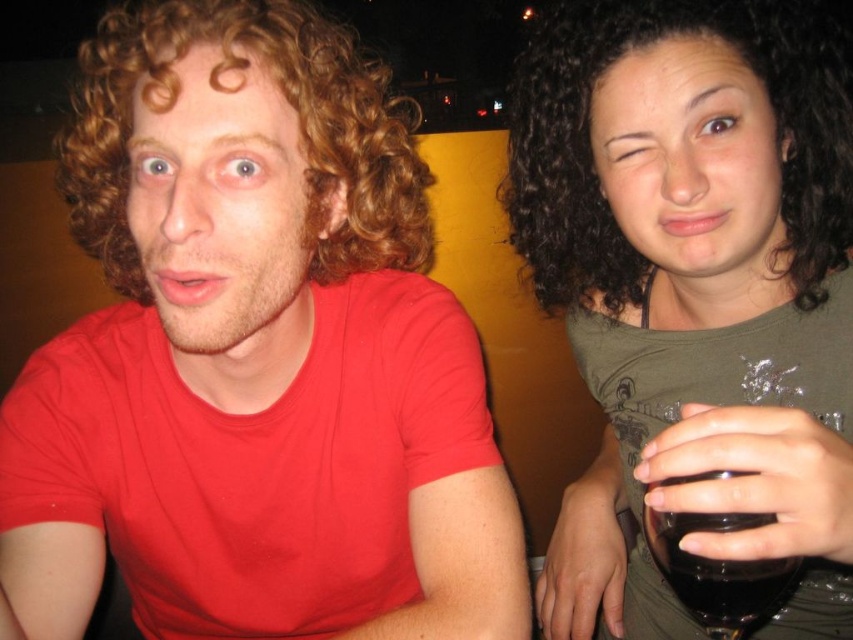
Question: Which point is farther to the camera?

Choices:
 (A) matte red shirt at center
 (B) green matte shirt at upper right
 (C) curly brown hair at left
 (D) dark glass at right

Answer: (B)

Question: In this image, where is matte red shirt at center located relative to curly brown hair at left?

Choices:
 (A) above
 (B) below

Answer: (B)

Question: Which point is closer to the camera taking this photo?

Choices:
 (A) (733, 104)
 (B) (109, 141)

Answer: (A)

Question: Is matte red shirt at center bigger than curly brown hair at left?

Choices:
 (A) yes
 (B) no

Answer: (B)

Question: Which of the following is the closest to the observer?

Choices:
 (A) (293, 48)
 (B) (601, 387)
 (C) (222, 472)

Answer: (A)

Question: Can you confirm if matte red shirt at center is wider than curly brown hair at left?

Choices:
 (A) no
 (B) yes

Answer: (A)